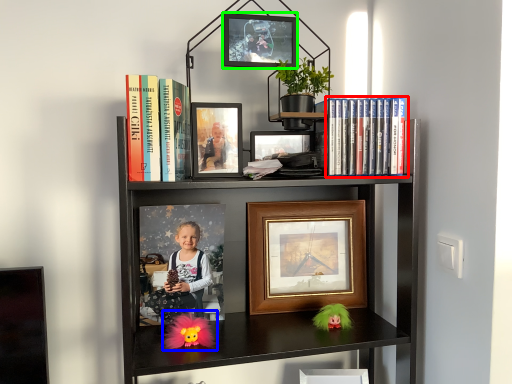
Question: Considering the real-world distances, which object is farthest from book (highlighted by a red box)? doll (highlighted by a blue box) or picture frame (highlighted by a green box)?

Choices:
 (A) doll
 (B) picture frame

Answer: (A)